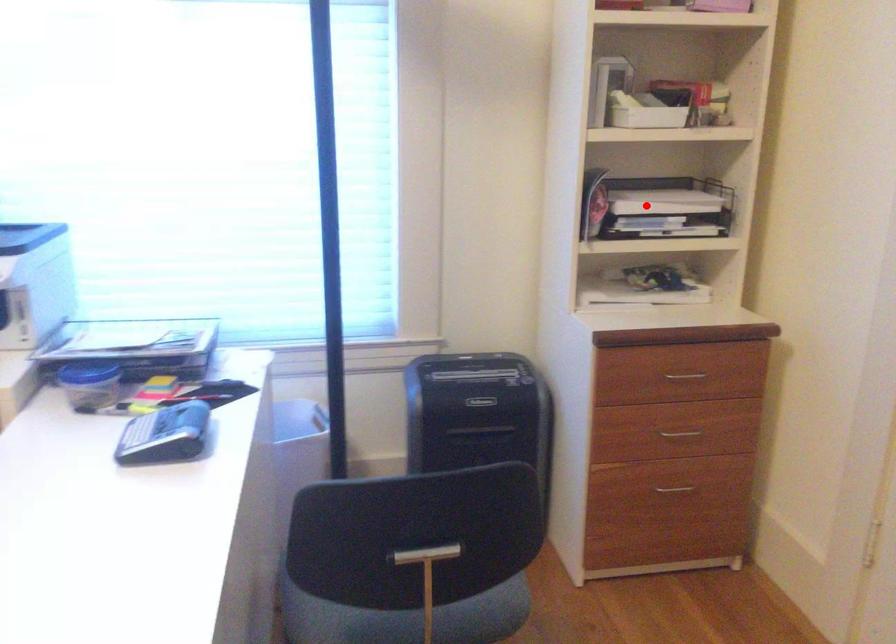
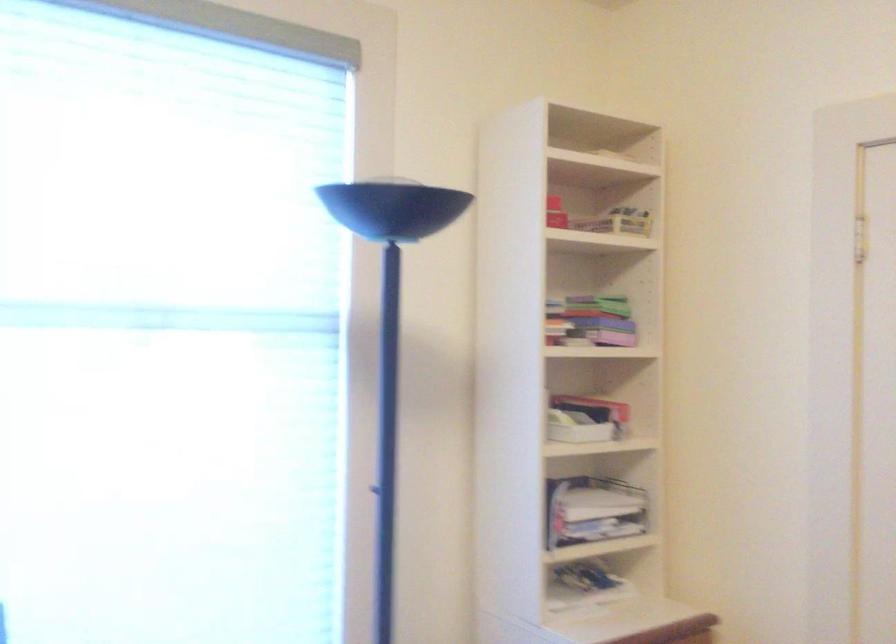
Locate, in the second image, the point that corresponds to the highlighted location in the first image.

(592, 509)